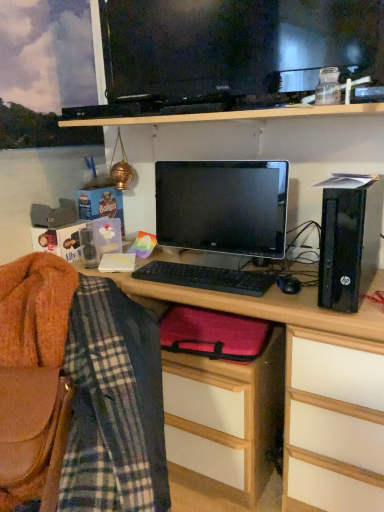
Question: Does point (220, 476) appear closer or farther from the camera than point (347, 200)?

Choices:
 (A) closer
 (B) farther

Answer: (B)

Question: Based on their sizes in the image, would you say matte red laptop case at lower center is bigger or smaller than black plastic computer tower at right?

Choices:
 (A) small
 (B) big

Answer: (B)

Question: Estimate the real-world distances between objects in this image. Which object is closer to the black plastic mouse at center?

Choices:
 (A) matte red laptop case at lower center
 (B) black matte keyboard at center
 (C) wooden desk at center
 (D) plaid fabric at left
 (E) black glossy tv at upper center

Answer: (B)

Question: Considering the real-world distances, which object is farthest from the matte red laptop case at lower center?

Choices:
 (A) satin black monitor at center
 (B) black plastic computer tower at right
 (C) black matte keyboard at center
 (D) black plastic mouse at center
 (E) black glossy tv at upper center

Answer: (E)